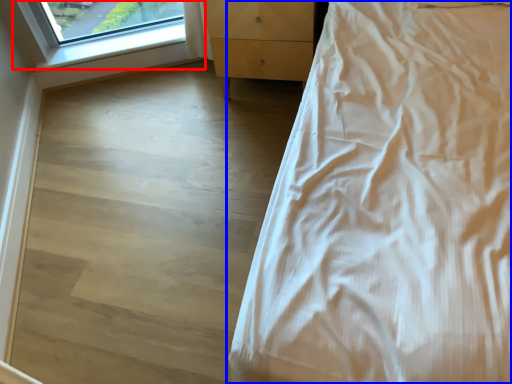
Question: Which object is closer to the camera taking this photo, window (highlighted by a red box) or bed (highlighted by a blue box)?

Choices:
 (A) window
 (B) bed

Answer: (B)